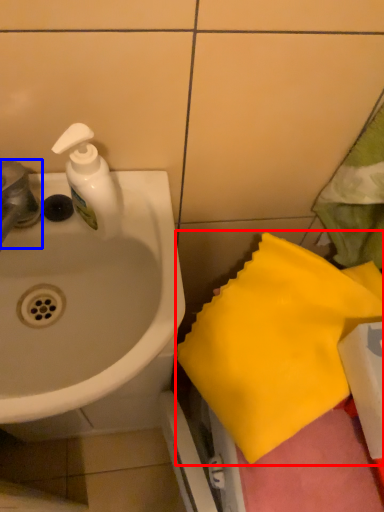
Question: Which object is closer to the camera taking this photo, beach towel (highlighted by a red box) or tap (highlighted by a blue box)?

Choices:
 (A) beach towel
 (B) tap

Answer: (A)